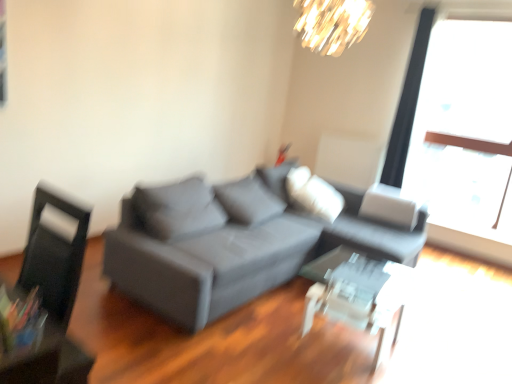
Question: From the image's perspective, is transparent glass table at center positioned above or below black leather swivel chair at left?

Choices:
 (A) above
 (B) below

Answer: (B)

Question: Considering the positions of transparent glass table at center and black leather swivel chair at left in the image, is transparent glass table at center wider or thinner than black leather swivel chair at left?

Choices:
 (A) wide
 (B) thin

Answer: (A)

Question: Which object is the closest to the black leather swivel chair at left?

Choices:
 (A) transparent glass table at center
 (B) shiny gold chandelier at upper center
 (C) transparent glass window at upper right
 (D) matte gray couch at center

Answer: (D)

Question: Based on their relative distances, which object is nearer to the transparent glass window at upper right?

Choices:
 (A) matte gray couch at center
 (B) shiny gold chandelier at upper center
 (C) black leather swivel chair at left
 (D) transparent glass table at center

Answer: (B)